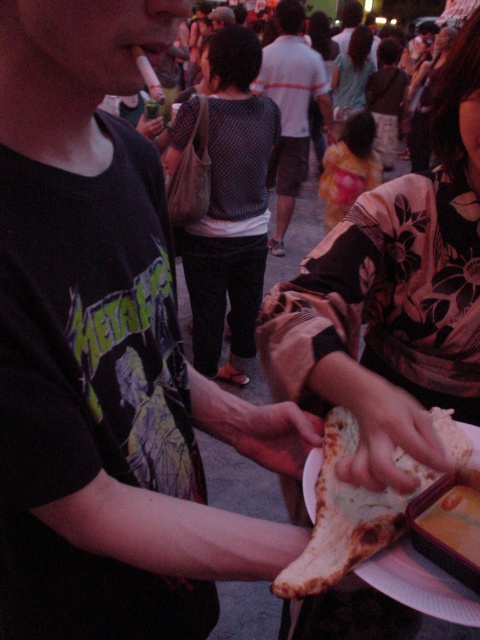
Question: Can you confirm if dark matte t-shirt at center is positioned above brown crispy flatbread at center?

Choices:
 (A) yes
 (B) no

Answer: (A)

Question: Which object appears farthest from the camera in this image?

Choices:
 (A) white cotton shirt at center
 (B) brown crispy bread at center

Answer: (A)

Question: Which object is farther from the camera taking this photo?

Choices:
 (A) brown leather hand at center
 (B) fluffy yellow hair at center
 (C) dark matte t-shirt at center
 (D) matte black hand at center

Answer: (B)

Question: Is dark matte t-shirt at center to the right of fluffy yellow hair at center from the viewer's perspective?

Choices:
 (A) yes
 (B) no

Answer: (B)

Question: Which point is closer to the camera?

Choices:
 (A) brown leather hand at center
 (B) smooth white bread at center

Answer: (B)

Question: Is smooth white bread at center bigger than matte black hand at center?

Choices:
 (A) yes
 (B) no

Answer: (B)